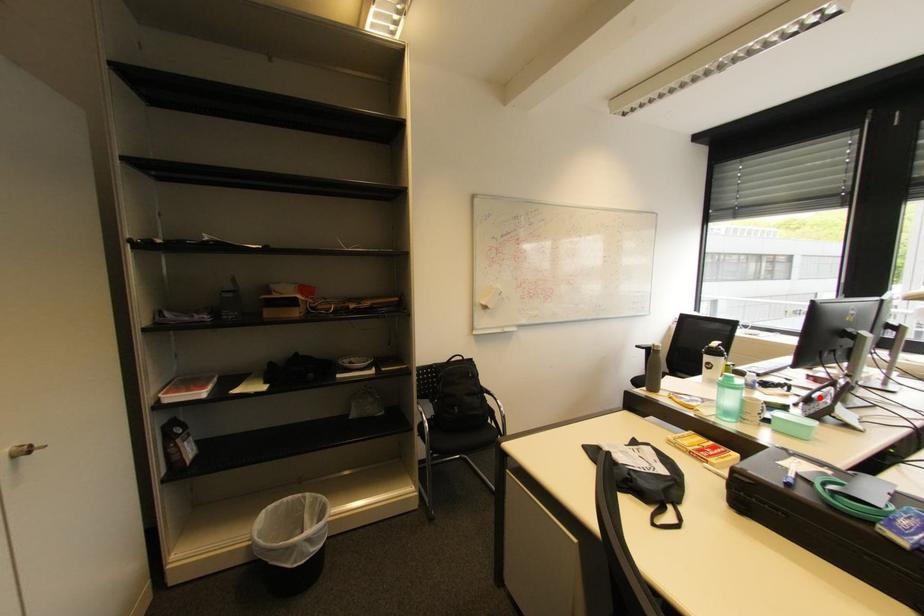
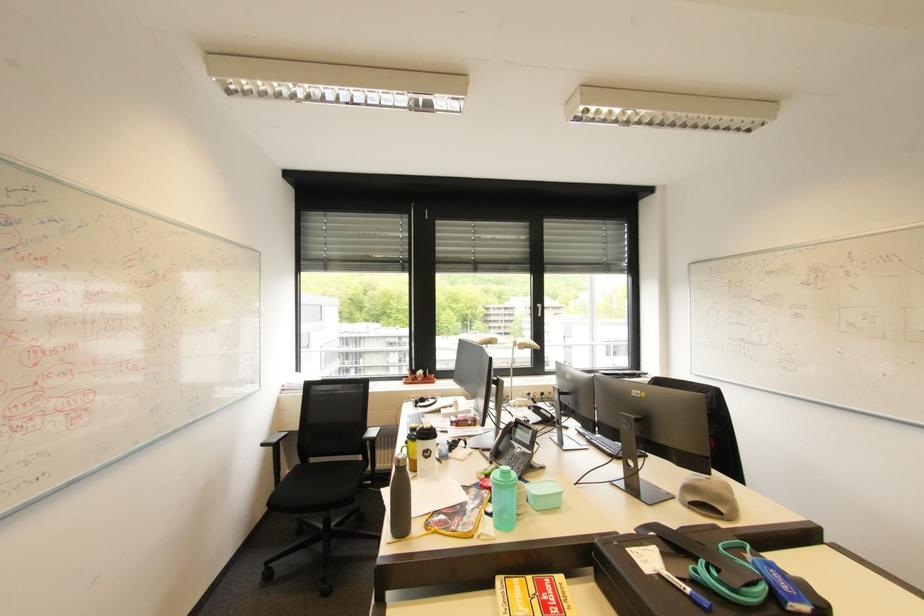
Locate, in the second image, the point that corresponds to the highlighted location in the first image.

(505, 448)